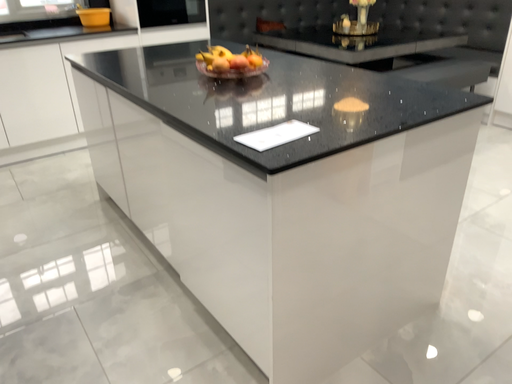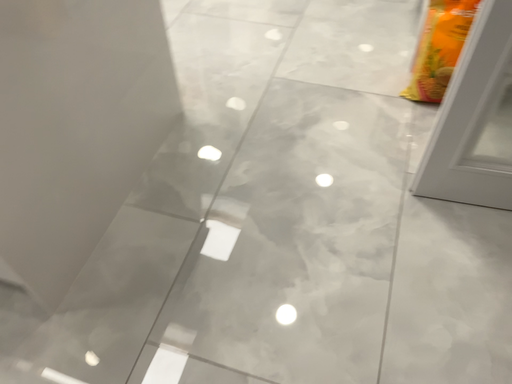
Question: How did the camera likely rotate when shooting the video?

Choices:
 (A) rotated downward
 (B) rotated upward

Answer: (A)